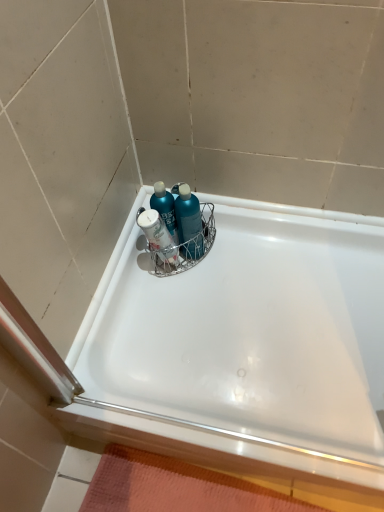
Where is `free space above white glossy ledge at lower right (from a real-world perspective)`? Image resolution: width=384 pixels, height=512 pixels. free space above white glossy ledge at lower right (from a real-world perspective) is located at coordinates (230, 446).